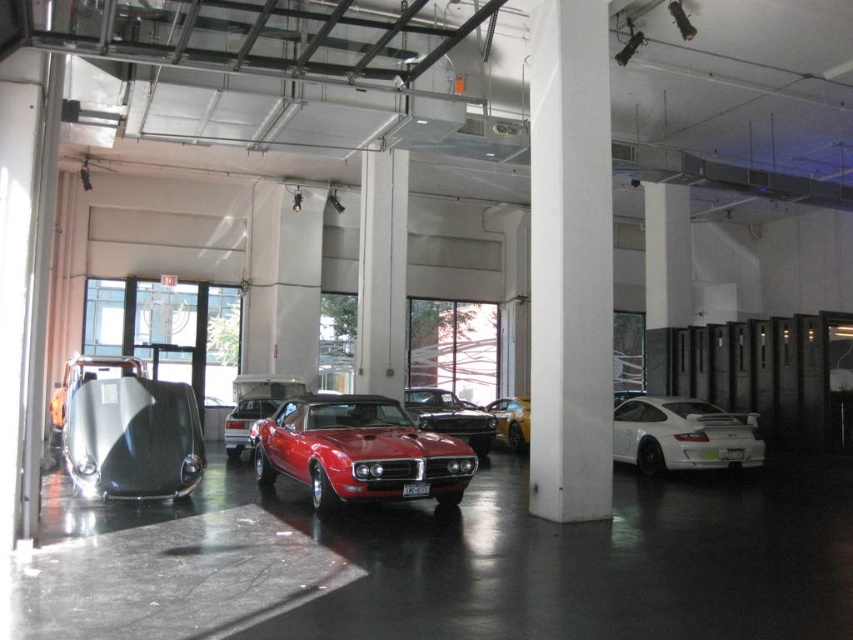
You are a delivery person needing to move a large crate from the entrance to the shiny black car at center in the parking garage. There is a white concrete pillar at center in the way. Can you navigate around it if your path requires moving 10 meters to the left and then 10 meters forward?

The white concrete pillar at center is 9.45 meters away from the shiny black car at center. If you move 10 meters to the left and then 10 meters forward, you would have enough space to navigate around the pillar since the distance between them allows for such a maneuver.